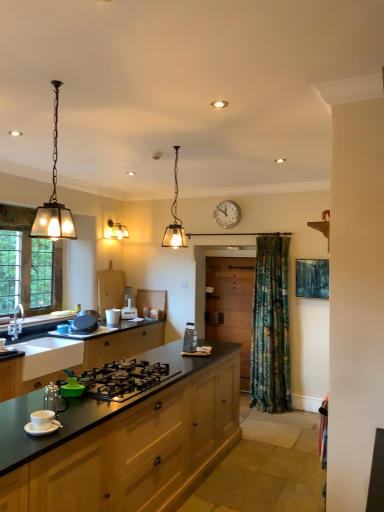
Question: In terms of width, does brushed metal faucet at left look wider or thinner when compared to wooden cabinet at center, which ranks as the 1th cabinetry in back-to-front order?

Choices:
 (A) thin
 (B) wide

Answer: (B)

Question: Visually, is brushed metal faucet at left positioned to the left or to the right of wooden cabinet at center, which ranks as the 1th cabinetry in back-to-front order?

Choices:
 (A) right
 (B) left

Answer: (B)

Question: Which object is positioned farthest from the matte black frying pan at left, the third appliance from the back?

Choices:
 (A) matte glass pendant light at upper left, the first lamp viewed from the front
 (B) matte black countertop at lower left, the 1th cabinetry positioned from the front
 (C) matte glass pendant light at upper center, placed as the second lamp when sorted from front to back
 (D) white ceramic cup at lower left, arranged as the 4th appliance when viewed from the left
 (E) white plastic clock at upper center

Answer: (D)

Question: Based on their relative distances, which object is farther from the matte glass pendant light at center?

Choices:
 (A) matte black frying pan at left, the 1th appliance viewed from the left
 (B) matte glass pendant light at upper center, positioned as the 1th lamp in back-to-front order
 (C) metallic silver tea pot at lower left
 (D) white ceramic cup at lower left, the 5th appliance from the back
 (E) brushed metal faucet at left

Answer: (B)